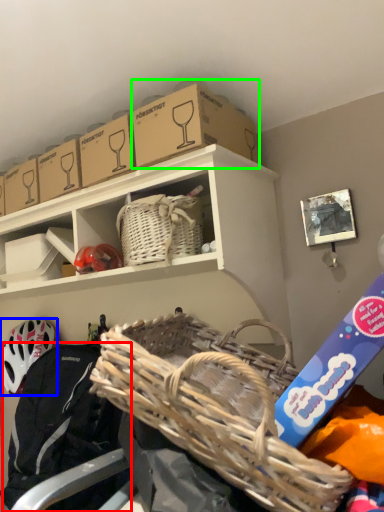
Question: Which is nearer to the clothing (highlighted by a red box)? helmet (highlighted by a blue box) or storage box (highlighted by a green box).

Choices:
 (A) helmet
 (B) storage box

Answer: (A)